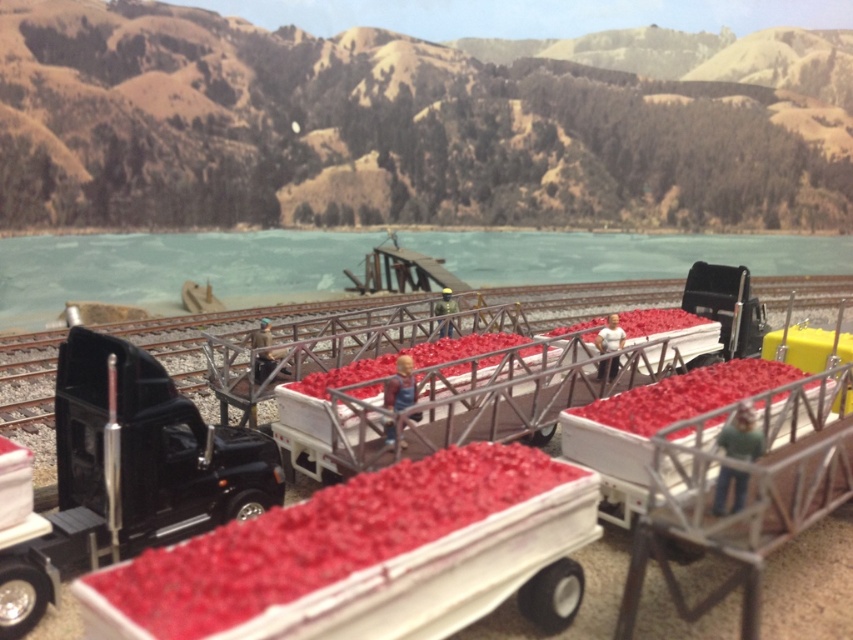
Question: Does smooth red plastic produce at center appear over rubberized plastic produce at center?

Choices:
 (A) no
 (B) yes

Answer: (A)

Question: Which is nearer to the smooth plastic crate of red berries at center?

Choices:
 (A) rubberized plastic produce at center
 (B) clear blue water at upper center
 (C) metallic gray train track at center
 (D) smooth red plastic produce at center

Answer: (A)

Question: Is smooth red plastic produce at center to the right of smooth plastic crate of red berries at center from the viewer's perspective?

Choices:
 (A) no
 (B) yes

Answer: (A)

Question: Among these points, which one is farthest from the camera?

Choices:
 (A) (434, 552)
 (B) (47, 552)
 (C) (173, 300)

Answer: (C)

Question: Can you confirm if smooth red plastic produce at center is wider than smooth plastic crate of red berries at center?

Choices:
 (A) no
 (B) yes

Answer: (B)

Question: Which object is closer to the camera taking this photo?

Choices:
 (A) metallic gray train track at center
 (B) clear blue water at upper center
 (C) black matte trailer truck at left
 (D) rubberized plastic produce at center

Answer: (C)